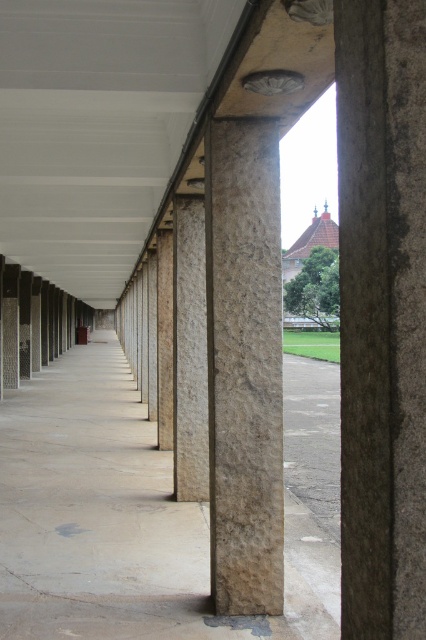
Between natural stone column at center and brown rough stone column at center, which one has more height?

With more height is brown rough stone column at center.

Can you confirm if natural stone column at center is positioned above brown rough stone column at center?

No.

What do you see at coordinates (141, 513) in the screenshot? The width and height of the screenshot is (426, 640). I see `natural stone column at center` at bounding box center [141, 513].

Where is `natural stone column at center`? The width and height of the screenshot is (426, 640). natural stone column at center is located at coordinates (141, 513).